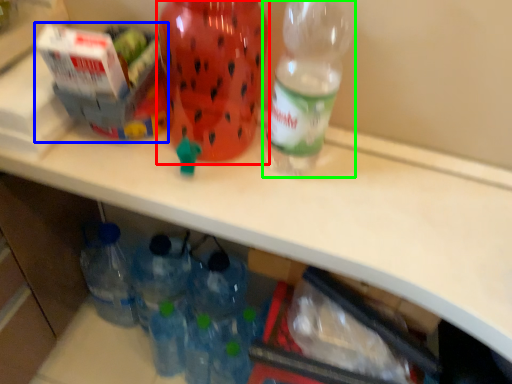
Question: Which is nearer to the bottle (highlighted by a red box)? box (highlighted by a blue box) or bottle (highlighted by a green box).

Choices:
 (A) box
 (B) bottle

Answer: (A)